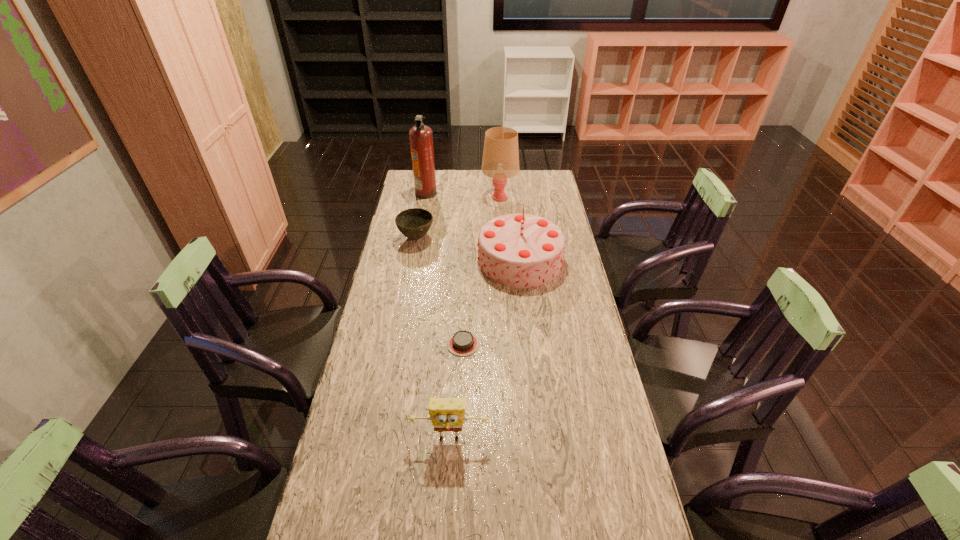
Find the location of `vacant space at the far edge of the desktop`. vacant space at the far edge of the desktop is located at coordinates (475, 186).

Where is `vacant space at the left edge of the desktop`? This screenshot has width=960, height=540. vacant space at the left edge of the desktop is located at coordinates (359, 400).

The width and height of the screenshot is (960, 540). What are the coordinates of `vacant region at the right edge of the desktop` in the screenshot? It's located at (583, 413).

In order to click on free spot between the shortest object and the sponge in this screenshot , I will do `click(456, 392)`.

Identify the location of free space that is in between the second tallest object and the chocolate cake. (481, 271).

You are a GUI agent. You are given a task and a screenshot of the screen. Output one action in this format:
    pyautogui.click(x=<x>, y=<y>)
    Task: Click on the unoccupied position between the fire extinguisher and the fifth shortest object
    
    Given the screenshot: What is the action you would take?
    pyautogui.click(x=463, y=195)

Image resolution: width=960 pixels, height=540 pixels. Find the location of `blank region between the second shortest object and the fourth shortest object`. blank region between the second shortest object and the fourth shortest object is located at coordinates (468, 249).

Where is `free spot between the lampshade and the tallest object`? free spot between the lampshade and the tallest object is located at coordinates (463, 195).

Locate an element on the screen. the closest object relative to the fifth shortest object is located at coordinates (421, 138).

Identify which object is the third nearest to the second nearest object. Please provide its 2D coordinates. Your answer should be formatted as a tuple, i.e. [(x, y)], where the tuple contains the x and y coordinates of a point satisfying the conditions above.

[(414, 223)]